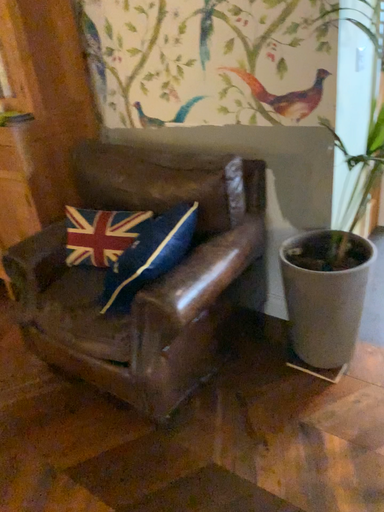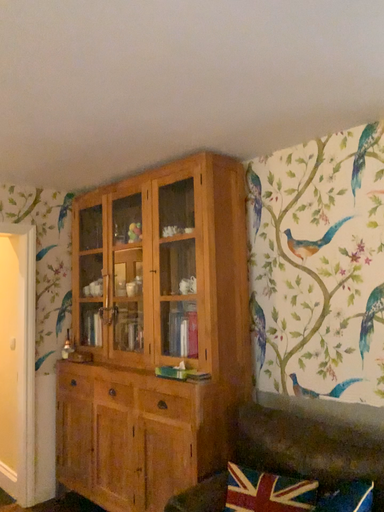
Question: How did the camera likely rotate when shooting the video?

Choices:
 (A) rotated right
 (B) rotated left

Answer: (B)